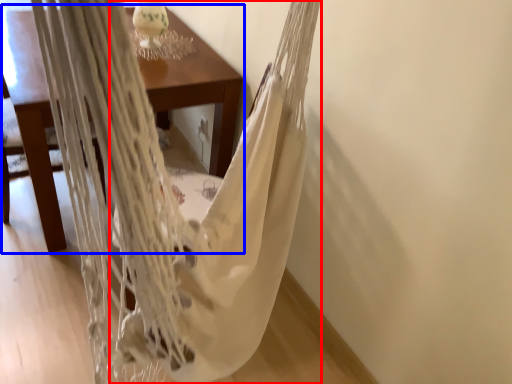
Question: Which object appears closest to the camera in this image, blanket (highlighted by a red box) or table (highlighted by a blue box)?

Choices:
 (A) blanket
 (B) table

Answer: (A)